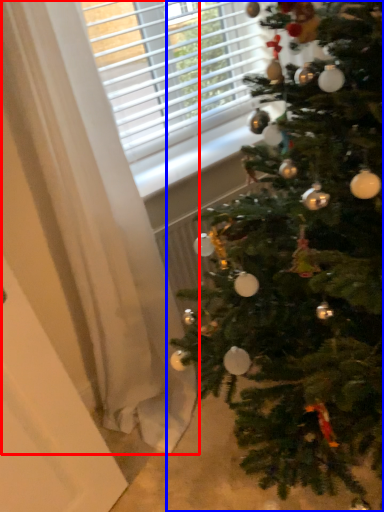
Question: Which point is closer to the camera, curtain (highlighted by a red box) or christmas tree (highlighted by a blue box)?

Choices:
 (A) curtain
 (B) christmas tree

Answer: (B)